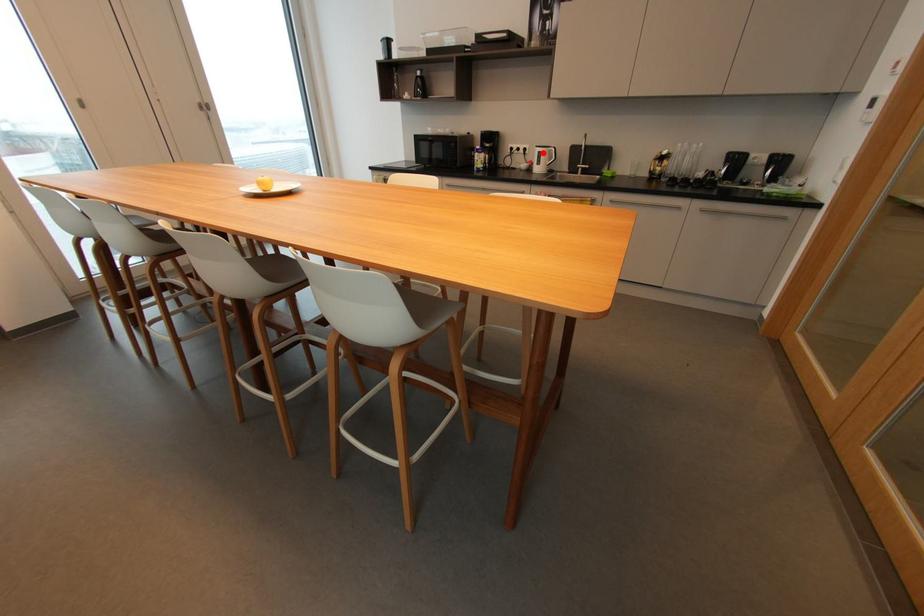
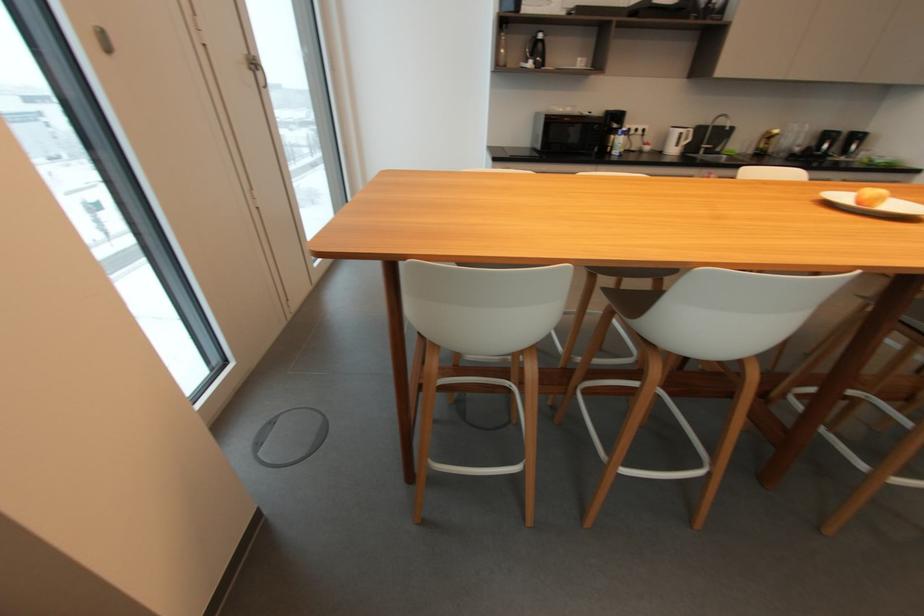
Where in the second image is the point corresponding to the highlighted location from the first image?

(685, 134)